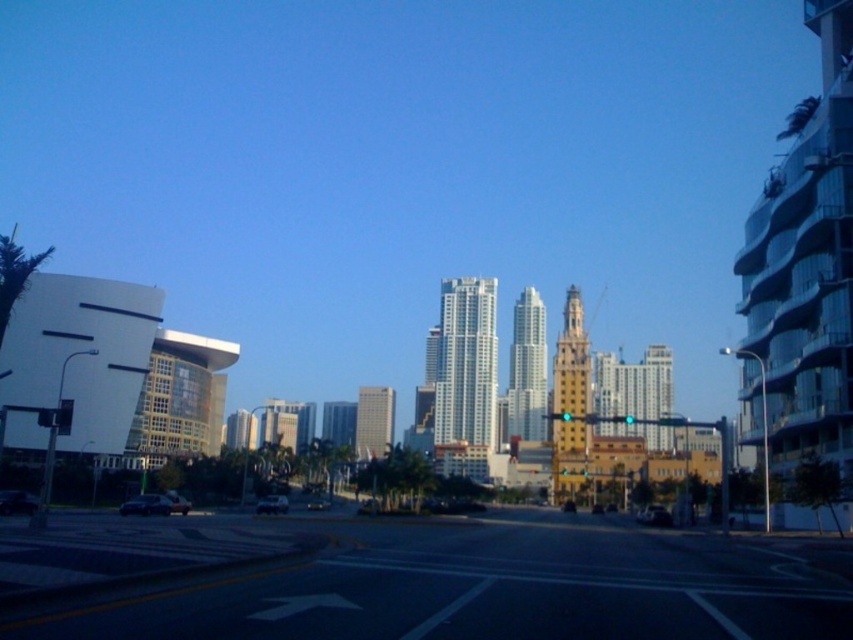
Question: Is glassy white building at right bigger than yellow brick tower at center?

Choices:
 (A) yes
 (B) no

Answer: (A)

Question: Which object appears closest to the camera in this image?

Choices:
 (A) white glass building at center
 (B) yellow brick tower at center

Answer: (B)

Question: Is white glass building at center below gray glass skyscraper at center?

Choices:
 (A) no
 (B) yes

Answer: (A)

Question: Among these points, which one is nearest to the camera?

Choices:
 (A) (374, 388)
 (B) (750, 433)
 (C) (538, 356)
 (D) (558, 365)

Answer: (B)

Question: Which point is farther to the camera?

Choices:
 (A) silver glass skyscraper at center
 (B) glassy white building at right
 (C) white glass building at center

Answer: (A)

Question: Is white glass building at center positioned at the back of silver glass skyscraper at center?

Choices:
 (A) yes
 (B) no

Answer: (B)